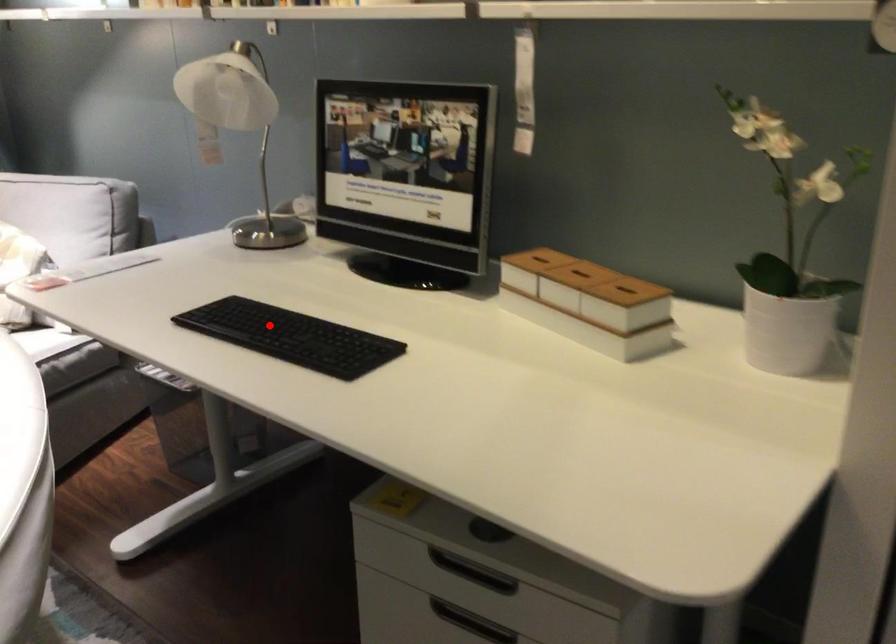
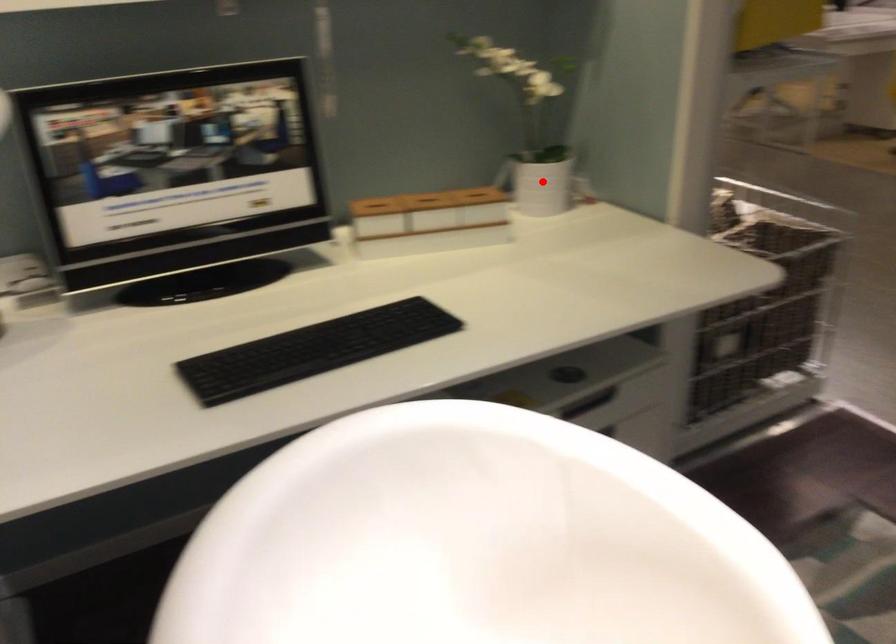
I am providing you with two images of the same scene from different viewpoints. A red point is marked on the first image and another point is marked on the second image. Is the red point in image1 aligned with the point shown in image2?

No